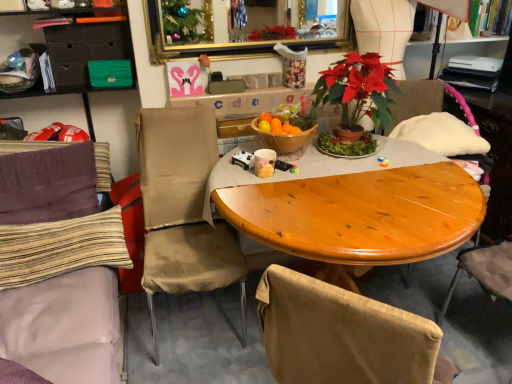
Question: Considering the relative positions of striped fabric pillow at left, the first pillow from the bottom, and purple knit fabric at left, marked as the 2th chair in a right-to-left arrangement, in the image provided, is striped fabric pillow at left, the first pillow from the bottom, to the left or to the right of purple knit fabric at left, marked as the 2th chair in a right-to-left arrangement,?

Choices:
 (A) left
 (B) right

Answer: (B)

Question: Is point (41, 223) positioned closer to the camera than point (88, 183)?

Choices:
 (A) farther
 (B) closer

Answer: (B)

Question: Which object is positioned closest to the purple knit fabric at left, marked as the 2th chair in a right-to-left arrangement?

Choices:
 (A) floral-patterned ceramic mug at center
 (B) striped fabric pillow at left, marked as the second pillow in a top-to-bottom arrangement
 (C) matte black drawer at upper left
 (D) gold-framed mirror at upper center
 (E) beige fabric chair at center, the first chair positioned from the right

Answer: (B)

Question: Which is nearer to the floral-patterned ceramic mug at center?

Choices:
 (A) purple knit fabric at left, positioned as the 1th chair in left-to-right order
 (B) wooden armchair at right
 (C) wooden bowl at center
 (D) beige fabric chair at center, the first chair positioned from the right
 (E) gold-framed mirror at upper center

Answer: (C)